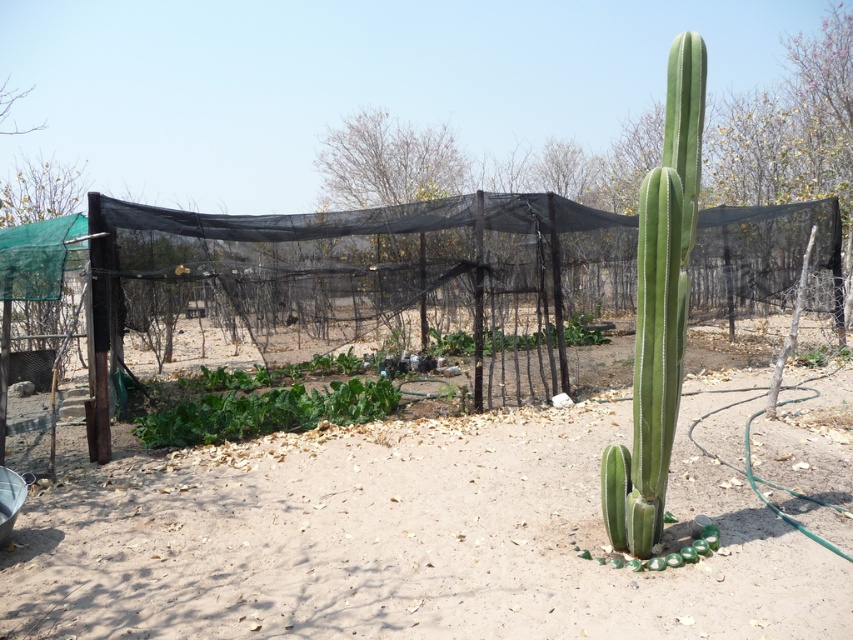
Question: Based on their relative distances, which object is nearer to the green leafy at center?

Choices:
 (A) dirt at center
 (B) green smooth cactus at right
 (C) green leafy plant at center

Answer: (A)

Question: Is green smooth cactus at right to the left of green leafy plant at center from the viewer's perspective?

Choices:
 (A) no
 (B) yes

Answer: (B)

Question: Which of the following is the closest to the observer?

Choices:
 (A) (335, 419)
 (B) (569, 337)
 (C) (590, 422)

Answer: (C)

Question: Can you confirm if dirt at center is positioned to the right of green smooth cactus at right?

Choices:
 (A) yes
 (B) no

Answer: (B)

Question: Which of the following is the farthest from the observer?

Choices:
 (A) (473, 337)
 (B) (296, 547)
 (C) (157, 438)
 (D) (659, 360)

Answer: (A)

Question: Does dirt at center have a smaller size compared to green leafy at center?

Choices:
 (A) yes
 (B) no

Answer: (A)